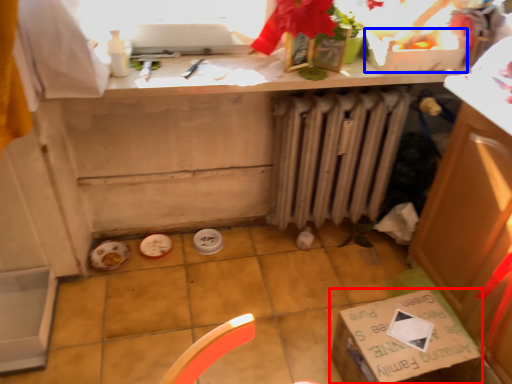
Question: Among these objects, which one is nearest to the camera, cardboard box (highlighted by a red box) or box (highlighted by a blue box)?

Choices:
 (A) cardboard box
 (B) box

Answer: (A)